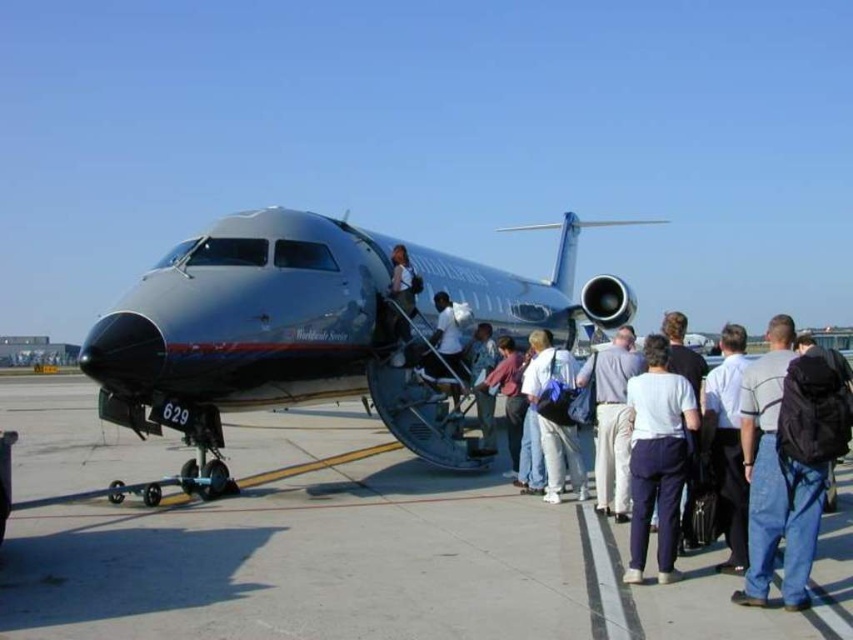
This screenshot has width=853, height=640. I want to click on light blue shirt at center, so [612, 419].

Who is lower down, white cotton shirt at center or white fabric bag at center?

white cotton shirt at center

Which is in front, point (664, 499) or point (538, 388)?

Point (664, 499) is more forward.

I want to click on white cotton shirt at center, so click(x=657, y=458).

Can you confirm if denim jeans at right is wider than white shirt at center?

No, denim jeans at right is not wider than white shirt at center.

Who is taller, denim jeans at right or white shirt at center?

white shirt at center is taller.

Is point (747, 595) positioned after point (463, 372)?

No, (747, 595) is closer to viewer.

In order to click on denim jeans at right in this screenshot , I will do `click(773, 480)`.